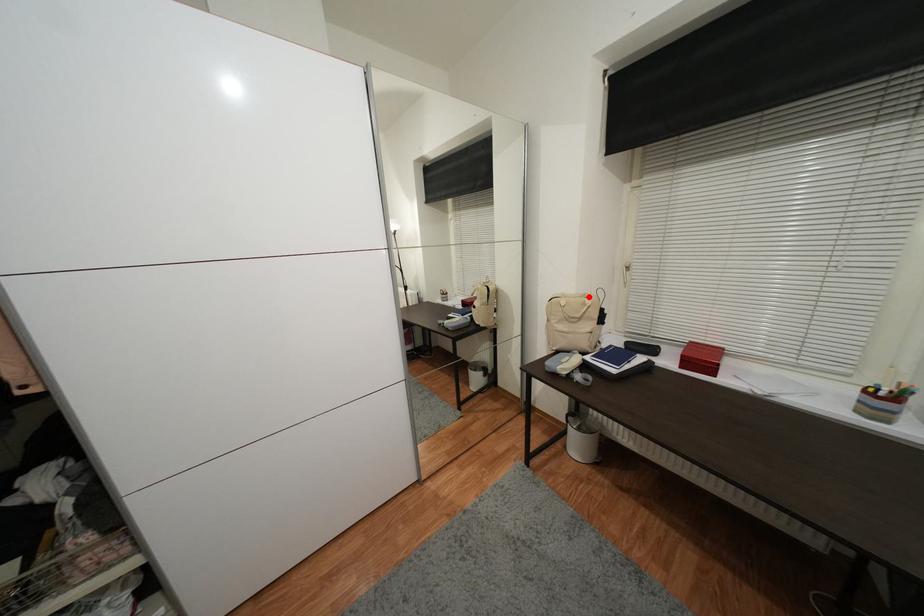
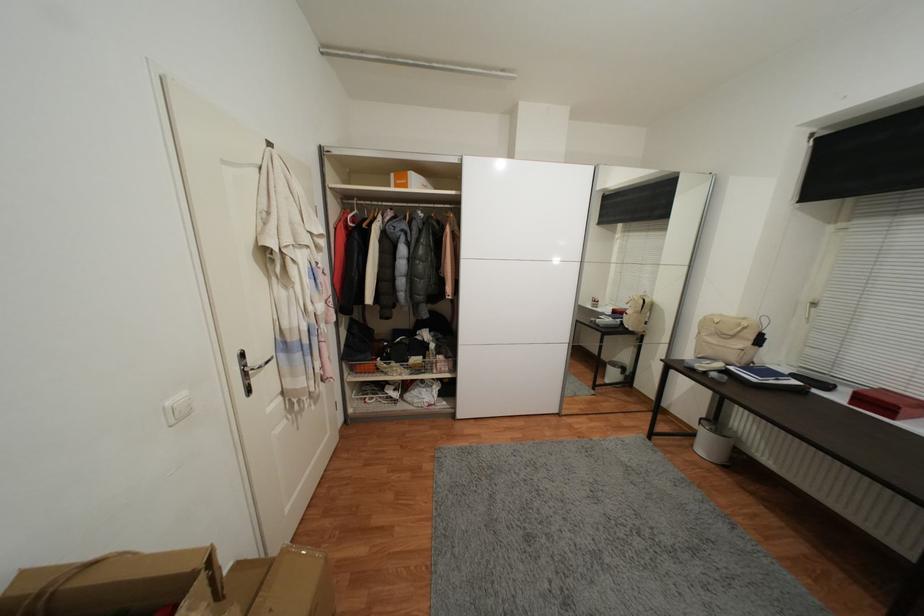
The point at the highlighted location is marked in the first image. Where is the corresponding point in the second image?

(748, 321)